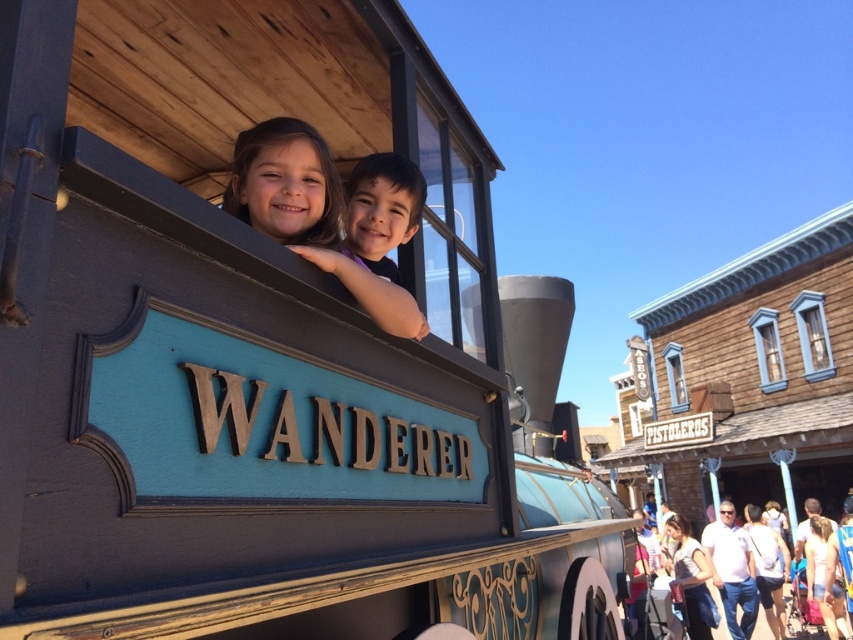
Question: Does matte black hair at upper center have a lesser width compared to white matte coach at lower right?

Choices:
 (A) no
 (B) yes

Answer: (A)

Question: Which of the following is the closest to the observer?

Choices:
 (A) (283, 205)
 (B) (729, 529)

Answer: (A)

Question: Does matte black hair at upper center appear over white matte coach at lower right?

Choices:
 (A) yes
 (B) no

Answer: (A)

Question: Among these points, which one is nearest to the camera?

Choices:
 (A) (360, 296)
 (B) (746, 625)

Answer: (A)

Question: Can you confirm if matte black hair at upper center is smaller than white matte coach at lower right?

Choices:
 (A) yes
 (B) no

Answer: (A)